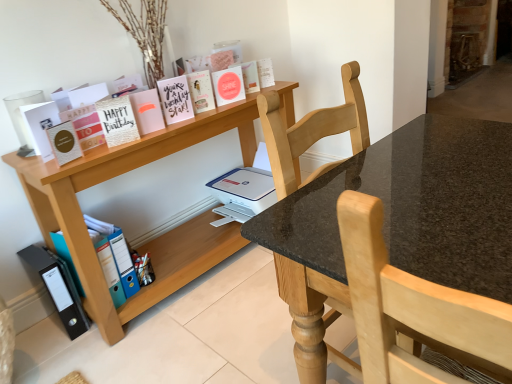
Find the location of `free space in front of pink matte card at upper center, which appears as the 5th paperback book when viewed from the left`. free space in front of pink matte card at upper center, which appears as the 5th paperback book when viewed from the left is located at coordinates (137, 141).